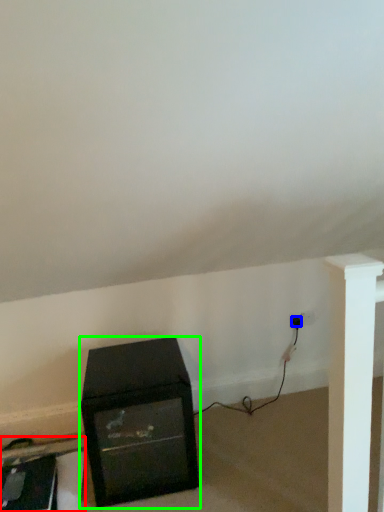
Question: Which object is the closest to the furniture (highlighted by a red box)? Choose among these: plug (highlighted by a blue box) or furniture (highlighted by a green box).

Choices:
 (A) plug
 (B) furniture

Answer: (B)